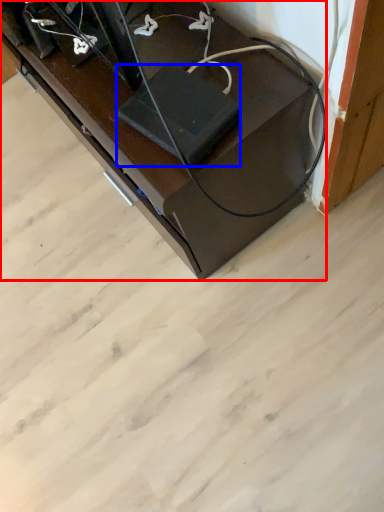
Question: Which of the following is the farthest to the observer, furniture (highlighted by a red box) or wide (highlighted by a blue box)?

Choices:
 (A) furniture
 (B) wide

Answer: (A)